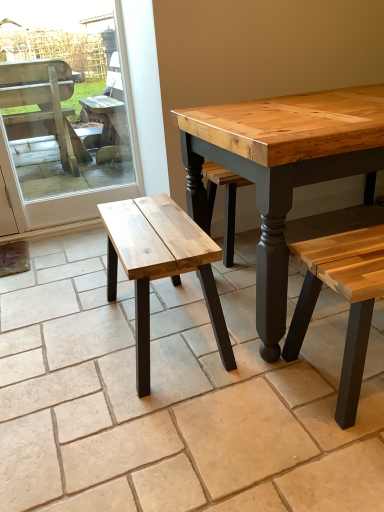
Identify the location of vacant region to the left of natural wood bench at center. (66, 339).